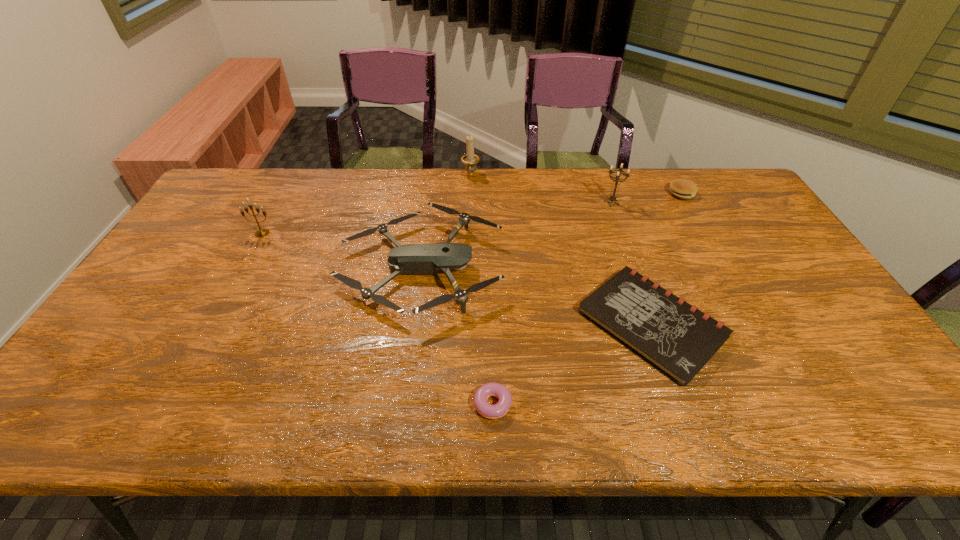
Find the location of a particular element. vacant space situated 0.360m on the handle side of the farthest object is located at coordinates (468, 247).

At what (x,y) coordinates should I click in order to perform the action: click on free region located 0.180m on the left of the rightmost candelabrum. Please return your answer as a coordinate pair (x, y). The height and width of the screenshot is (540, 960). Looking at the image, I should click on (549, 203).

Locate an element on the screen. The width and height of the screenshot is (960, 540). vacant area situated 0.090m on the back of the leftmost object is located at coordinates (274, 212).

At what (x,y) coordinates should I click in order to perform the action: click on vacant space located with a camera mounted on the front of the drone. Please return your answer as a coordinate pair (x, y). This screenshot has height=540, width=960. Looking at the image, I should click on (639, 268).

This screenshot has width=960, height=540. Find the location of `vacant region located 0.090m on the left of the third shortest object`. vacant region located 0.090m on the left of the third shortest object is located at coordinates (642, 193).

This screenshot has height=540, width=960. In order to click on vacant space located 0.080m on the back of the notebook in this screenshot , I will do `click(627, 254)`.

Find the location of a particular element. The image size is (960, 540). vacant space located on the back of the doughnut is located at coordinates (486, 269).

Find the location of a particular element. patty at the far edge is located at coordinates (681, 188).

Identify the location of object positioned at the near edge. (487, 410).

Identify the location of vacant space at the far edge. (618, 184).